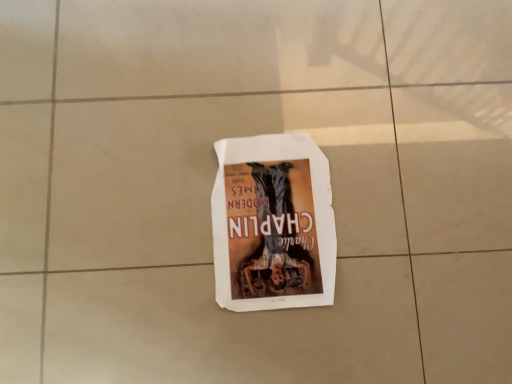
Find the location of a particular element. vacant area on top of white paper poster at center (from a real-world perspective) is located at coordinates (271, 215).